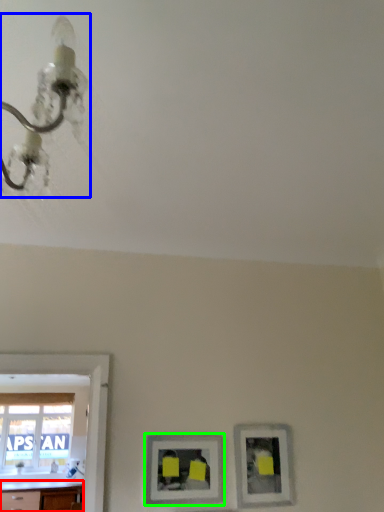
Question: Which is nearer to the counter top (highlighted by a red box)? light fixture (highlighted by a blue box) or picture frame (highlighted by a green box).

Choices:
 (A) light fixture
 (B) picture frame

Answer: (B)